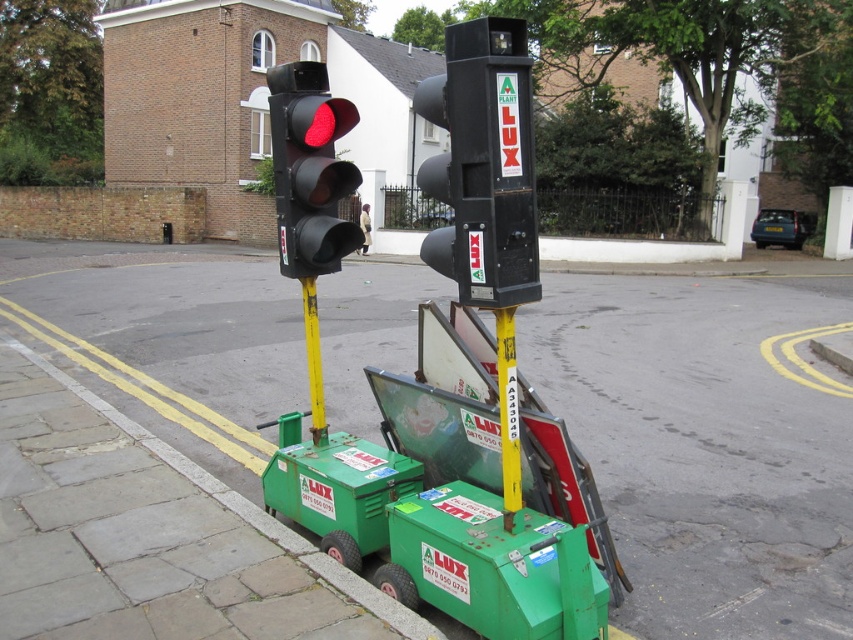
You are a city inspector checking the traffic light setup. You notice two poles, a yellow plastic pole at center and a yellow metallic pole at center. Which pole is positioned higher in the setup?

The yellow plastic pole at center is located above the yellow metallic pole at center, so it is positioned higher.

From the picture: You are a pedestrian standing at the edge of the street. You see a black plastic traffic light at center and a green plastic cart at lower center. Which object is positioned to the right side from your viewpoint?

The black plastic traffic light at center is positioned to the right of the green plastic cart at lower center, so it is on the right side from your viewpoint.